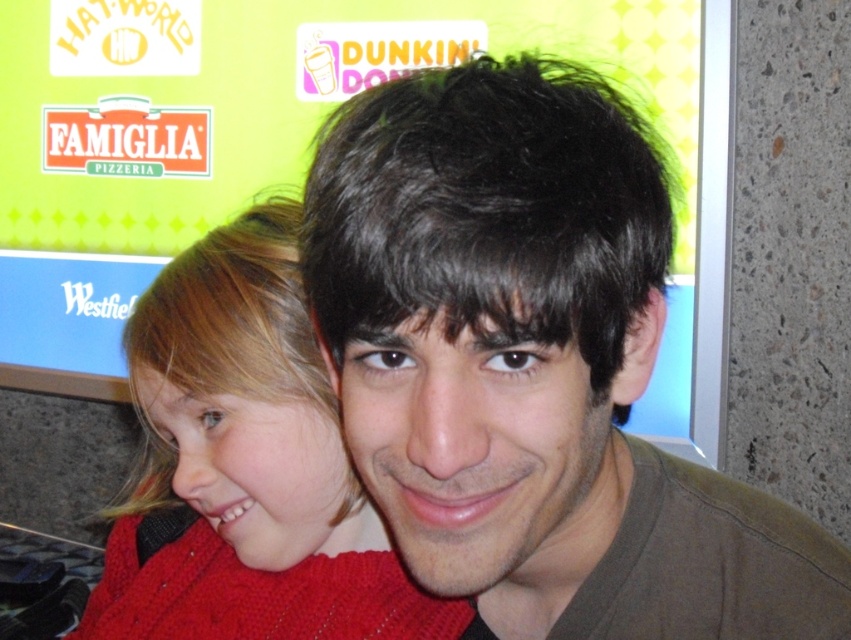
Question: Does knitted sweater at left come in front of black matte hair at center?

Choices:
 (A) no
 (B) yes

Answer: (A)

Question: Can you confirm if brown matte hair at center is wider than black matte hair at center?

Choices:
 (A) no
 (B) yes

Answer: (B)

Question: Which of the following is the farthest from the observer?

Choices:
 (A) (544, 493)
 (B) (490, 102)

Answer: (A)

Question: Is brown matte hair at center smaller than knitted sweater at left?

Choices:
 (A) no
 (B) yes

Answer: (B)

Question: Which of the following is the closest to the observer?

Choices:
 (A) (538, 292)
 (B) (389, 179)
 (C) (317, 604)

Answer: (A)

Question: Which object is the closest to the brown matte hair at center?

Choices:
 (A) black matte hair at center
 (B) knitted sweater at left

Answer: (A)